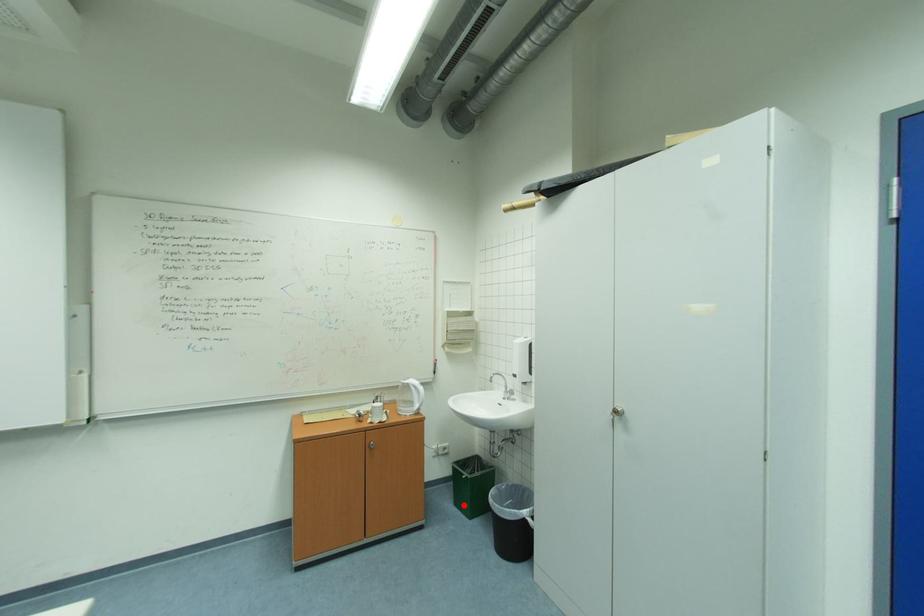
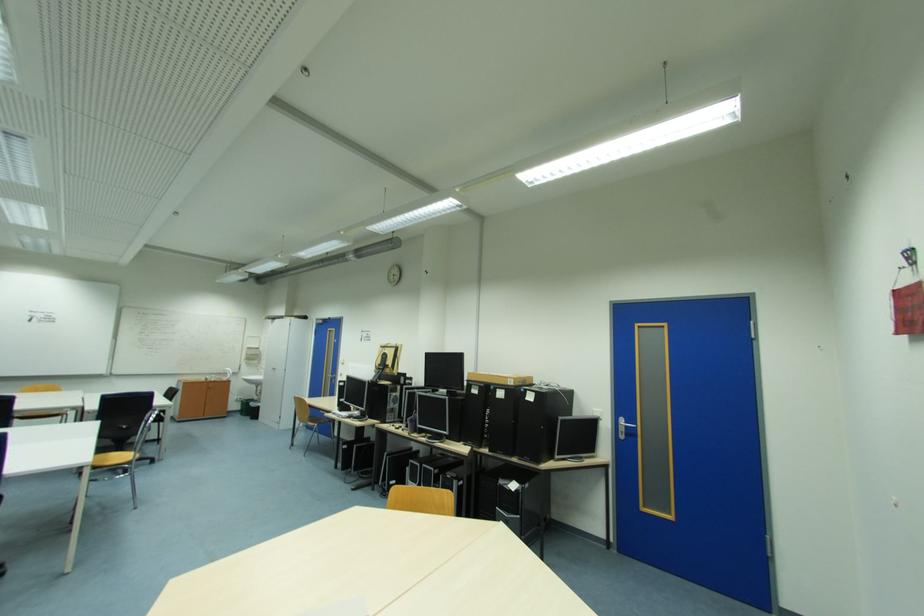
Question: I am providing you with two images of the same scene from different viewpoints. A red point is marked on the first image. At the location where the point appears in image 1, is it still visible in image 2?

Choices:
 (A) Yes
 (B) No

Answer: (A)